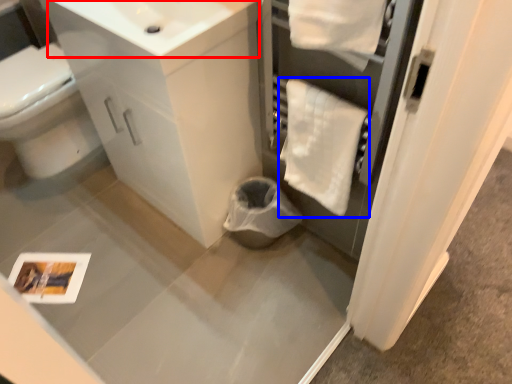
Question: Among these objects, which one is nearest to the camera, sink (highlighted by a red box) or bath towel (highlighted by a blue box)?

Choices:
 (A) sink
 (B) bath towel

Answer: (A)